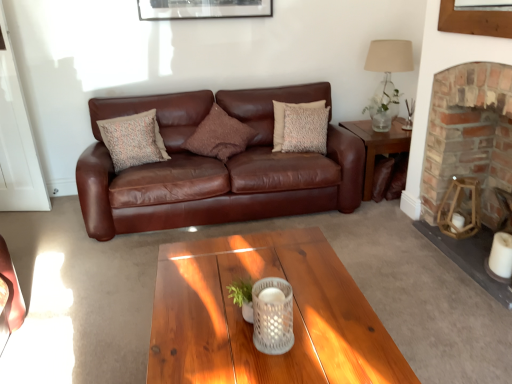
Question: Is textured beige pillow at center, placed as the 1th pillow when sorted from left to right, facing towards metallic silver picture frame at upper center?

Choices:
 (A) yes
 (B) no

Answer: (B)

Question: Are textured beige pillow at center, placed as the 1th pillow when sorted from left to right, and metallic silver picture frame at upper center far apart?

Choices:
 (A) yes
 (B) no

Answer: (A)

Question: Is textured beige pillow at center, placed as the 1th pillow when sorted from left to right, outside of metallic silver picture frame at upper center?

Choices:
 (A) yes
 (B) no

Answer: (A)

Question: Considering the relative sizes of textured beige pillow at center, positioned as the third pillow in right-to-left order, and metallic silver picture frame at upper center in the image provided, is textured beige pillow at center, positioned as the third pillow in right-to-left order, smaller than metallic silver picture frame at upper center?

Choices:
 (A) no
 (B) yes

Answer: (A)

Question: From the image's perspective, is textured beige pillow at center, positioned as the third pillow in right-to-left order, beneath metallic silver picture frame at upper center?

Choices:
 (A) no
 (B) yes

Answer: (B)

Question: From the image's perspective, is textured beige pillow at center, positioned as the third pillow in right-to-left order, on top of metallic silver picture frame at upper center?

Choices:
 (A) no
 (B) yes

Answer: (A)

Question: From a real-world perspective, is brick fireplace at right positioned under wooden side table at right based on gravity?

Choices:
 (A) no
 (B) yes

Answer: (A)

Question: Considering the relative sizes of brick fireplace at right and wooden side table at right in the image provided, is brick fireplace at right smaller than wooden side table at right?

Choices:
 (A) yes
 (B) no

Answer: (B)

Question: Can you confirm if brick fireplace at right is wider than wooden side table at right?

Choices:
 (A) no
 (B) yes

Answer: (A)

Question: From the image's perspective, is brick fireplace at right on wooden side table at right?

Choices:
 (A) yes
 (B) no

Answer: (B)

Question: Can you confirm if brick fireplace at right is positioned to the left of wooden side table at right?

Choices:
 (A) yes
 (B) no

Answer: (B)

Question: Can you confirm if brick fireplace at right is bigger than wooden side table at right?

Choices:
 (A) no
 (B) yes

Answer: (B)

Question: Does brown leather couch at center have a greater width compared to wooden side table at right?

Choices:
 (A) yes
 (B) no

Answer: (A)